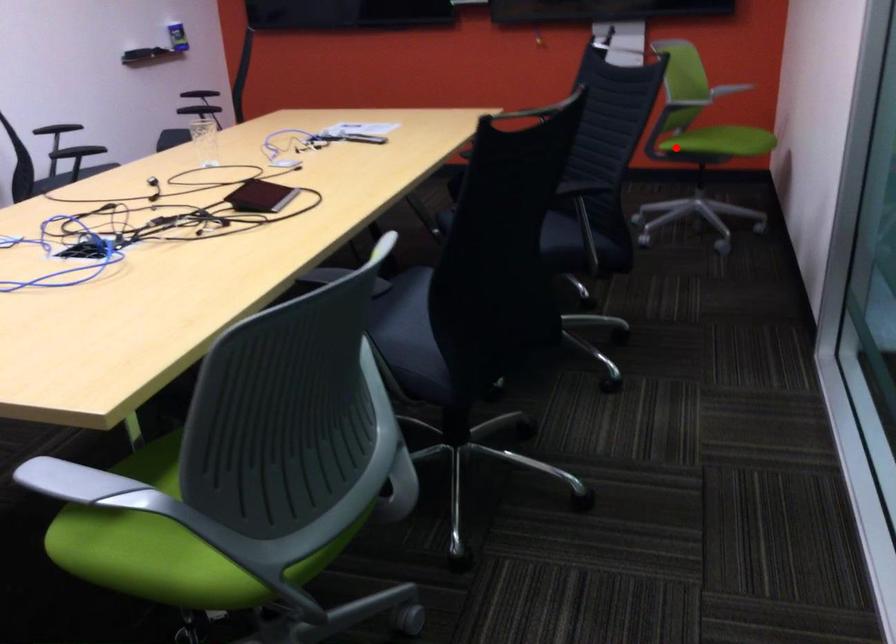
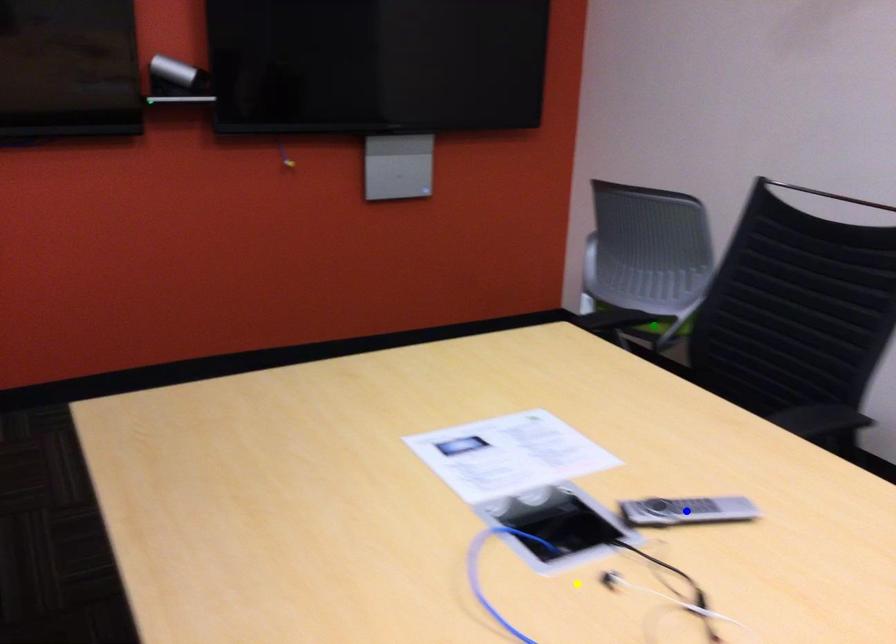
Question: I am providing you with two images of the same scene from different viewpoints. A red point is marked on the first image. You are given multiple points on the second image. Which point in image 2 is actually the same real-world point as the red point in image 1?

Choices:
 (A) green point
 (B) blue point
 (C) yellow point

Answer: (A)